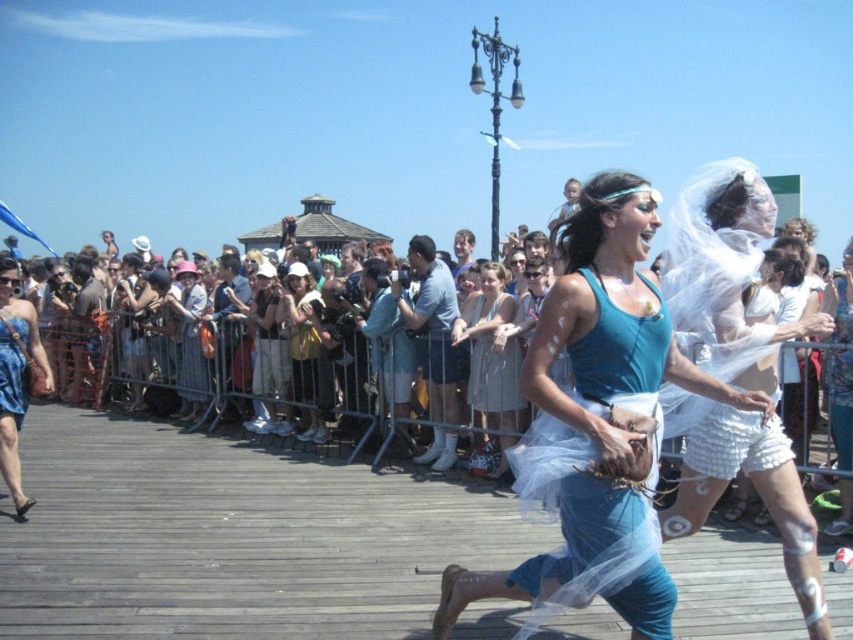
You are a photographer at the event and want to capture both the teal fabric dress at center and the blue denim shorts at center in the same frame. Which one should you focus on first to ensure both are in the shot?

You should focus on the blue denim shorts at center first since the teal fabric dress at center is to the right of it, allowing you to adjust the frame to include both.